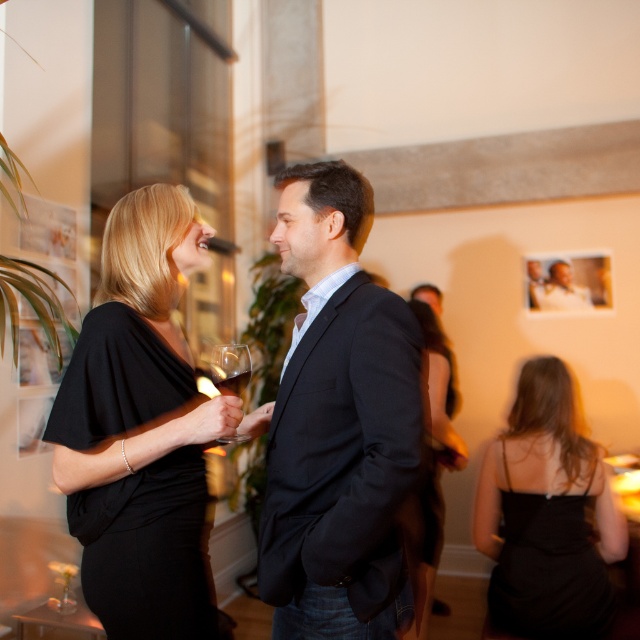
You are a photographer at the event and want to capture a photo of both the black satin dress at left and the black satin dress at center without any obstruction. Can you position yourself in a way that both dresses are fully visible in the frame?

The black satin dress at center is behind the black satin dress at left, so positioning yourself to the side or slightly behind the black satin dress at left would allow both to be visible without obstruction.

You are at a social event and want to move from your current position to the exit located near the point labeled as point (246,364). There is an obstacle at point labeled as point (412,602). Can you safely walk around the obstacle to reach the exit?

Since point (412,602) is in front of point (246,364), the obstacle is blocking the direct path to the exit. You will need to navigate around it to reach the exit safely.

You are standing at the point labeled as point (442,381) in the image. You want to take a photo of the entire room without moving your position. Based on the information provided, can you estimate whether your camera, which has a standard 50mm lens, will be able to capture the entire scene in one shot?

The distance between point (442,381) and the camera is 2.87 meters. With a standard 50mm lens, the field of view is typically around 46 degrees. To capture the entire scene, the camera would need to have a wide enough angle to encompass all elements in the room from that position. However, without knowing the exact dimensions of the room or the required field of view, it is difficult to definitively confirm if the entire scene can be captured in one shot with the given lens.